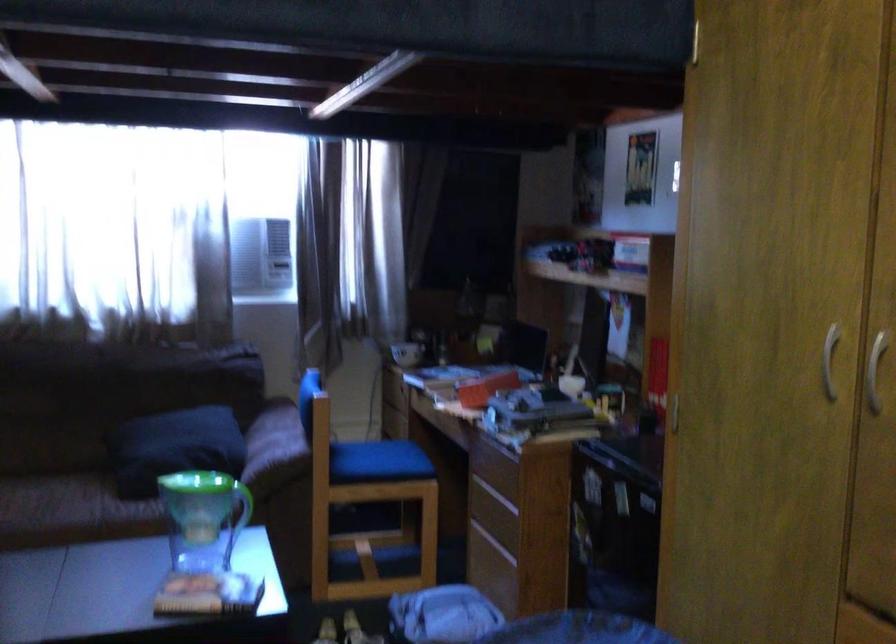
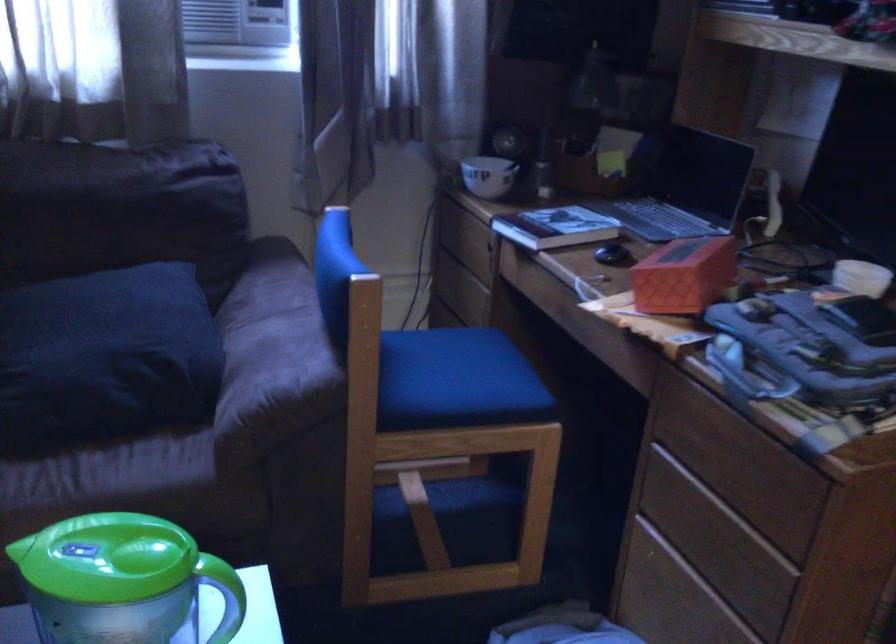
The point at (500, 469) is marked in the first image. Where is the corresponding point in the second image?

(739, 462)